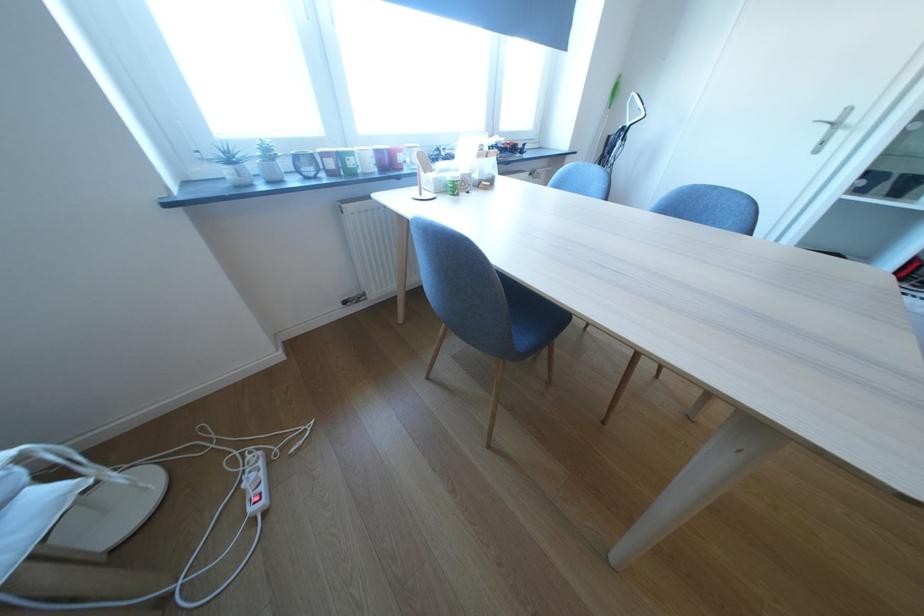
Image resolution: width=924 pixels, height=616 pixels. I want to click on white power strip, so click(x=256, y=483).